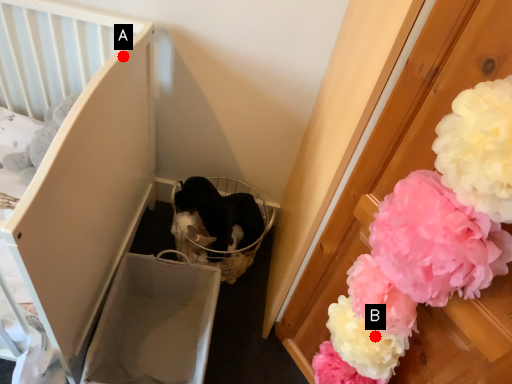
Question: Two points are circled on the image, labeled by A and B beside each circle. Which point is farther to the camera?

Choices:
 (A) A is further
 (B) B is further

Answer: (A)